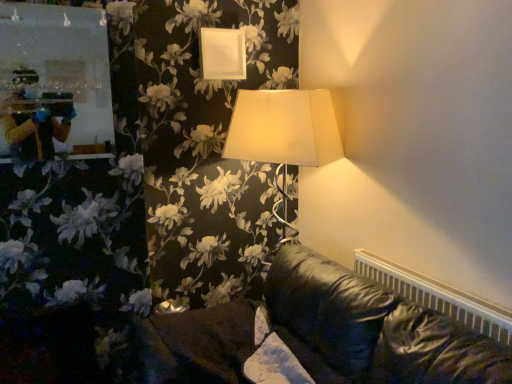
What do you see at coordinates (222, 54) in the screenshot? I see `white matte picture frame at upper center` at bounding box center [222, 54].

What are the coordinates of `white matte picture frame at upper center` in the screenshot? It's located at (222, 54).

Consider the image. Measure the distance between white plastic radiator at lower right and camera.

A distance of 1.34 meters exists between white plastic radiator at lower right and camera.

At what (x,y) coordinates should I click in order to perform the action: click on white plastic radiator at lower right. Please return your answer as a coordinate pair (x, y). This screenshot has width=512, height=384. Looking at the image, I should click on (437, 296).

Describe the element at coordinates (437, 296) in the screenshot. This screenshot has height=384, width=512. I see `white plastic radiator at lower right` at that location.

Identify the location of white matte picture frame at upper center. (222, 54).

Which object is positioned more to the left, white plastic radiator at lower right or white matte picture frame at upper center?

Positioned to the left is white matte picture frame at upper center.

Based on the photo, considering the positions of objects white plastic radiator at lower right and white matte picture frame at upper center in the image provided, who is behind, white plastic radiator at lower right or white matte picture frame at upper center?

white matte picture frame at upper center is more distant.

Considering the positions of points (478, 330) and (212, 72), is point (478, 330) farther from camera compared to point (212, 72)?

No, it is in front of (212, 72).

From the image's perspective, is white plastic radiator at lower right beneath white matte picture frame at upper center?

Yes, from the image's perspective, white plastic radiator at lower right is beneath white matte picture frame at upper center.

From a real-world perspective, relative to white matte picture frame at upper center, is white plastic radiator at lower right vertically above or below?

From a real-world perspective, white plastic radiator at lower right is physically below white matte picture frame at upper center.

Is white plastic radiator at lower right wider than white matte picture frame at upper center?

Yes.

Does white plastic radiator at lower right have a greater height compared to white matte picture frame at upper center?

No, white plastic radiator at lower right is not taller than white matte picture frame at upper center.

Which of these two, white plastic radiator at lower right or white matte picture frame at upper center, is smaller?

Smaller between the two is white matte picture frame at upper center.

Can we say white plastic radiator at lower right lies outside white matte picture frame at upper center?

That's correct, white plastic radiator at lower right is outside of white matte picture frame at upper center.

Is the surface of white plastic radiator at lower right in direct contact with white matte picture frame at upper center?

white plastic radiator at lower right and white matte picture frame at upper center are not in contact.

Is white matte picture frame at upper center at the back of white plastic radiator at lower right?

That's not correct — white plastic radiator at lower right is not looking away from white matte picture frame at upper center.

Can you tell me how much white plastic radiator at lower right and white matte picture frame at upper center differ in facing direction?

The facing directions of white plastic radiator at lower right and white matte picture frame at upper center are 92.5 degrees apart.

Identify the location of radiator on the right side of white matte picture frame at upper center. The image size is (512, 384). (437, 296).

Consider the image. Which is more to the left, white matte picture frame at upper center or white plastic radiator at lower right?

Positioned to the left is white matte picture frame at upper center.

Is the position of white matte picture frame at upper center less distant than that of white plastic radiator at lower right?

No, it is not.

Between point (236, 39) and point (379, 275), which one is positioned behind?

The point (236, 39) is farther from the camera.

From the image's perspective, is white matte picture frame at upper center under white plastic radiator at lower right?

No, from the image's perspective, white matte picture frame at upper center is not below white plastic radiator at lower right.

From a real-world perspective, does white matte picture frame at upper center stand above white plastic radiator at lower right?

Yes.

Does white matte picture frame at upper center have a lesser width compared to white plastic radiator at lower right?

Indeed, white matte picture frame at upper center has a lesser width compared to white plastic radiator at lower right.

Considering the relative sizes of white matte picture frame at upper center and white plastic radiator at lower right in the image provided, is white matte picture frame at upper center taller than white plastic radiator at lower right?

Indeed, white matte picture frame at upper center has a greater height compared to white plastic radiator at lower right.

Who is smaller, white matte picture frame at upper center or white plastic radiator at lower right?

With smaller size is white matte picture frame at upper center.

Is white matte picture frame at upper center inside the boundaries of white plastic radiator at lower right, or outside?

white matte picture frame at upper center is spatially situated outside white plastic radiator at lower right.

Is white matte picture frame at upper center with white plastic radiator at lower right?

No, white matte picture frame at upper center is not making contact with white plastic radiator at lower right.

Is white matte picture frame at upper center aimed at white plastic radiator at lower right?

No, white matte picture frame at upper center is not facing towards white plastic radiator at lower right.

Can you tell me how much white matte picture frame at upper center and white plastic radiator at lower right differ in facing direction?

92.5 degrees separate the facing orientations of white matte picture frame at upper center and white plastic radiator at lower right.

Could you measure the distance between white matte picture frame at upper center and white plastic radiator at lower right?

white matte picture frame at upper center is 1.39 meters from white plastic radiator at lower right.

Find the location of a particular element. The image size is (512, 384). picture frame lying behind the white plastic radiator at lower right is located at coordinates [x=222, y=54].

The height and width of the screenshot is (384, 512). I want to click on picture frame above the white plastic radiator at lower right (from a real-world perspective), so click(222, 54).

You are a GUI agent. You are given a task and a screenshot of the screen. Output one action in this format:
    pyautogui.click(x=<x>, y=<y>)
    Task: Click on the radiator that is under the white matte picture frame at upper center (from a real-world perspective)
    Image resolution: width=512 pixels, height=384 pixels.
    Given the screenshot: What is the action you would take?
    pos(437,296)